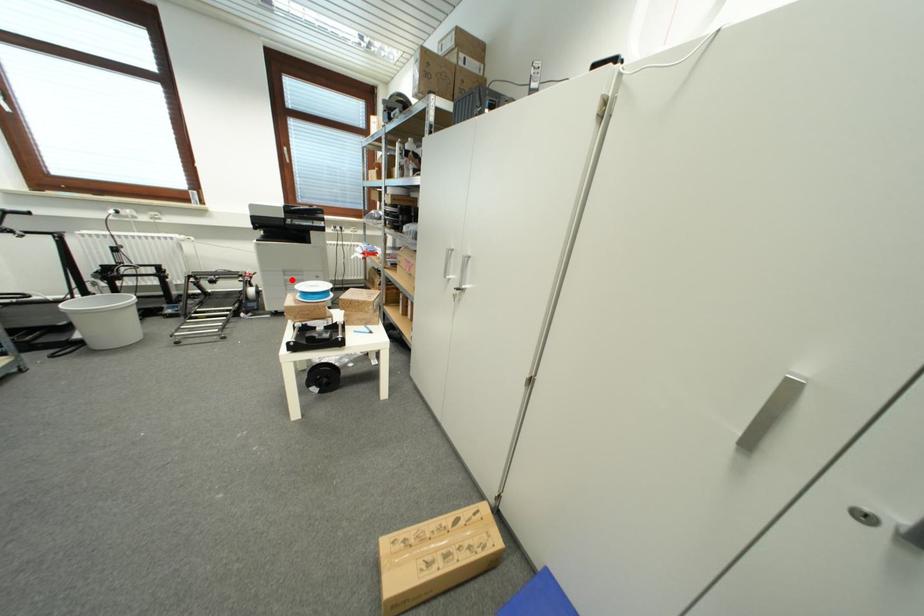
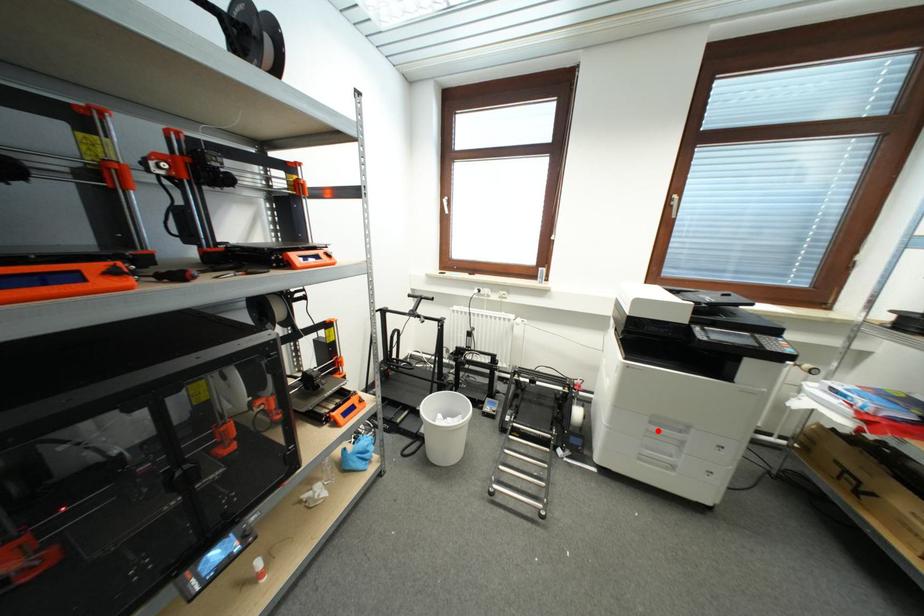
I am providing you with two images of the same scene from different viewpoints. A red point is marked on the first image and another point is marked on the second image. Does the point marked in image1 correspond to the same location as the one in image2?

Yes